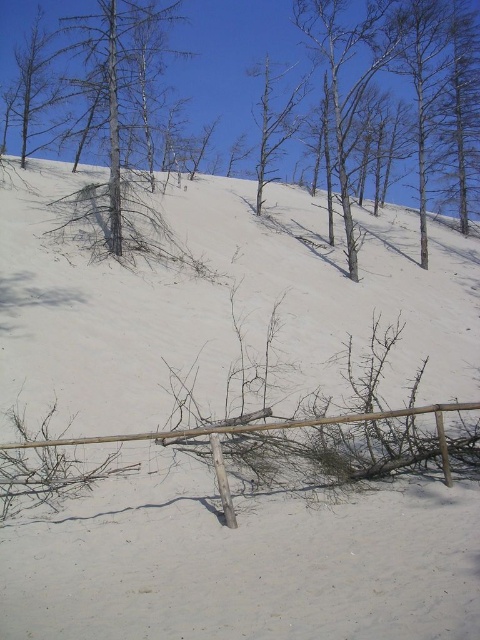
Does gray bark tree at upper left appear under bare wood tree at center?

No.

Is gray bark tree at upper left positioned in front of bare wood tree at center?

Yes, gray bark tree at upper left is in front of bare wood tree at center.

Between point (110, 250) and point (291, 120), which one is positioned in front?

Positioned in front is point (110, 250).

The height and width of the screenshot is (640, 480). In order to click on gray bark tree at upper left in this screenshot , I will do `click(108, 99)`.

Measure the distance between dead wood at center and bare wood tree at center.

dead wood at center is 2.42 meters away from bare wood tree at center.

Is dead wood at center below bare wood tree at center?

No, dead wood at center is not below bare wood tree at center.

Does point (168, 68) lie in front of point (262, 189)?

No, (168, 68) is further to viewer.

Identify the location of dead wood at center. The image size is (480, 640). (233, 60).

Is point (7, 45) positioned in front of point (99, 38)?

No, (7, 45) is further to viewer.

From the picture: Can you confirm if dead wood at center is bigger than gray bark tree at upper left?

Correct, dead wood at center is larger in size than gray bark tree at upper left.

Is point (300, 49) positioned in front of point (113, 60)?

No.

At what (x,y) coordinates should I click in order to perform the action: click on dead wood at center. Please return your answer as a coordinate pair (x, y). The height and width of the screenshot is (640, 480). Looking at the image, I should click on (233, 60).